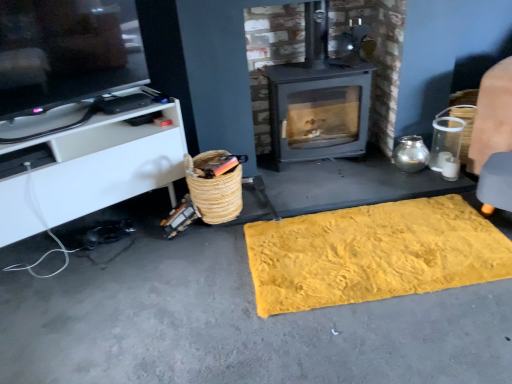
Question: Considering the relative sizes of matte black tv at upper left and yellow textured mat at center in the image provided, is matte black tv at upper left taller than yellow textured mat at center?

Choices:
 (A) yes
 (B) no

Answer: (A)

Question: Would you say yellow textured mat at center is part of matte black tv at upper left's contents?

Choices:
 (A) yes
 (B) no

Answer: (B)

Question: Can you confirm if matte black tv at upper left is positioned to the right of yellow textured mat at center?

Choices:
 (A) no
 (B) yes

Answer: (A)

Question: Is matte black tv at upper left oriented towards yellow textured mat at center?

Choices:
 (A) no
 (B) yes

Answer: (A)

Question: From a real-world perspective, is matte black tv at upper left positioned over yellow textured mat at center based on gravity?

Choices:
 (A) yes
 (B) no

Answer: (A)

Question: In terms of width, does yellow textured mat at center look wider or thinner when compared to matte black tv at upper left?

Choices:
 (A) wide
 (B) thin

Answer: (A)

Question: Considering their positions, is yellow textured mat at center located in front of or behind matte black tv at upper left?

Choices:
 (A) front
 (B) behind

Answer: (B)

Question: Is point (409, 251) positioned closer to the camera than point (37, 94)?

Choices:
 (A) farther
 (B) closer

Answer: (A)

Question: From a real-world perspective, is yellow textured mat at center physically located above or below matte black tv at upper left?

Choices:
 (A) below
 (B) above

Answer: (A)

Question: From the image's perspective, is yellow textured rug at lower center above or below matte gray wood burning stove at center?

Choices:
 (A) above
 (B) below

Answer: (B)

Question: Looking at their shapes, would you say yellow textured rug at lower center is wider or thinner than matte gray wood burning stove at center?

Choices:
 (A) thin
 (B) wide

Answer: (B)

Question: In terms of size, does yellow textured rug at lower center appear bigger or smaller than matte gray wood burning stove at center?

Choices:
 (A) small
 (B) big

Answer: (B)

Question: Based on their positions, is yellow textured rug at lower center located to the left or right of matte gray wood burning stove at center?

Choices:
 (A) left
 (B) right

Answer: (A)

Question: Which is correct: woven straw basket at lower left is inside matte black tv at upper left, or outside of it?

Choices:
 (A) outside
 (B) inside

Answer: (A)

Question: Is woven straw basket at lower left wider or thinner than matte black tv at upper left?

Choices:
 (A) wide
 (B) thin

Answer: (A)